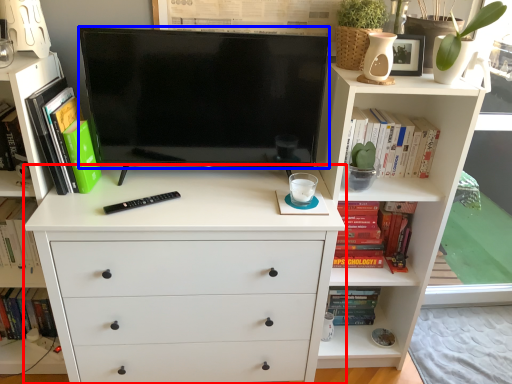
Question: Among these objects, which one is nearest to the camera, chest of drawers (highlighted by a red box) or television (highlighted by a blue box)?

Choices:
 (A) chest of drawers
 (B) television

Answer: (A)